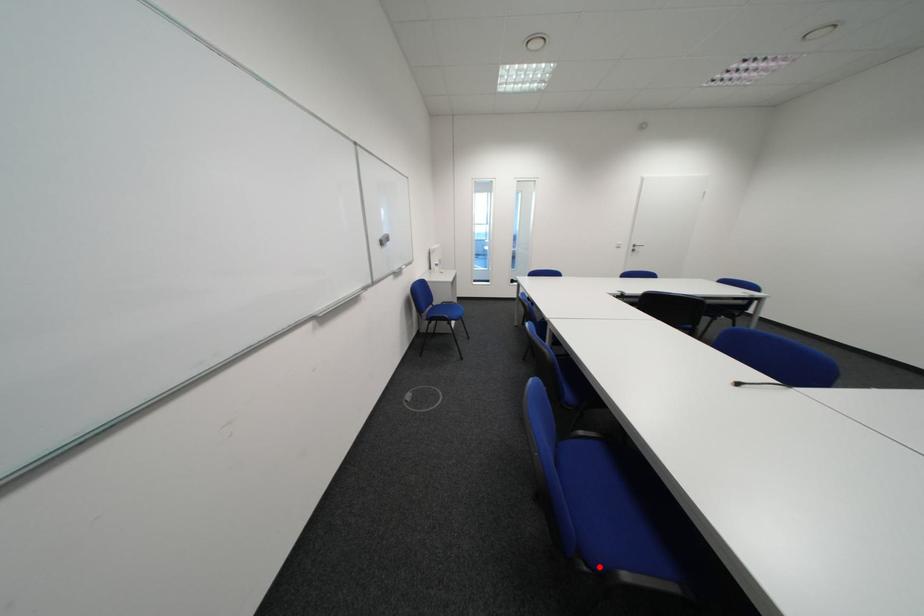
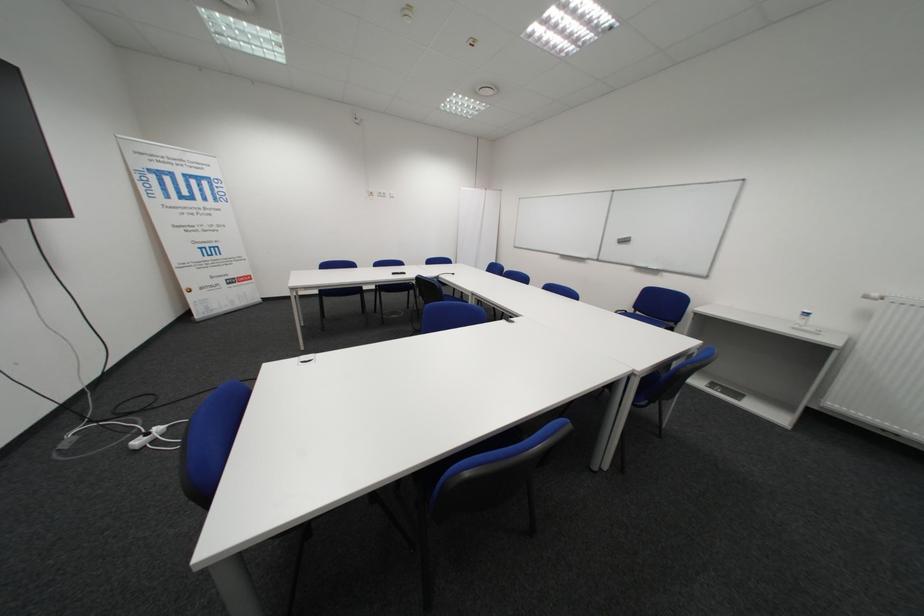
Question: I am providing you with two images of the same scene from different viewpoints. A red point is marked on the first image. Can you still see the location of the red point in image 2?

Choices:
 (A) Yes
 (B) No

Answer: (B)